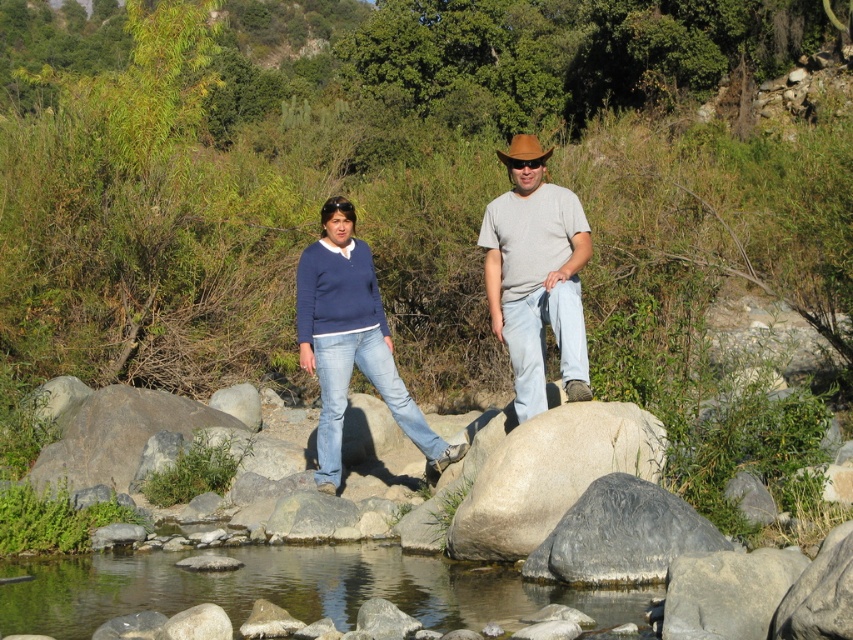
You are a photographer positioned at the camera capturing this scene. You want to ensure both points are visible in your shot. Given that the camera has a fixed focal length, will the point at coordinate point (515, 324) and point (503, 163) both be in frame?

Both points will be visible in the frame since the point at coordinate point (515, 324) is in front of point (503, 163), meaning they are positioned along the same line of sight and within the camera frame.